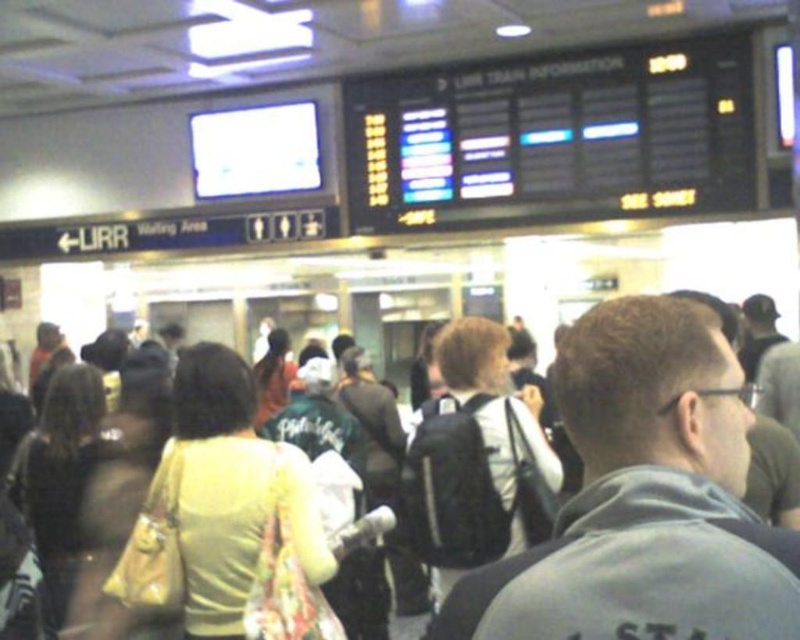
Question: Can you confirm if light yellow fabric purse at center is positioned above light beige fabric purse at left?

Choices:
 (A) no
 (B) yes

Answer: (B)

Question: Which point is closer to the camera?

Choices:
 (A) (85, 556)
 (B) (624, 557)
 (C) (274, 480)

Answer: (B)

Question: Which of the following is the closest to the observer?

Choices:
 (A) black backpack at center
 (B) light yellow fabric purse at center
 (C) light beige fabric purse at left

Answer: (C)

Question: Is light yellow fabric purse at center smaller than black backpack at center?

Choices:
 (A) yes
 (B) no

Answer: (A)

Question: Is gray fabric backpack at center positioned at the back of light beige fabric purse at left?

Choices:
 (A) no
 (B) yes

Answer: (A)

Question: Which object appears farthest from the camera in this image?

Choices:
 (A) black backpack at center
 (B) light beige fabric purse at left

Answer: (A)